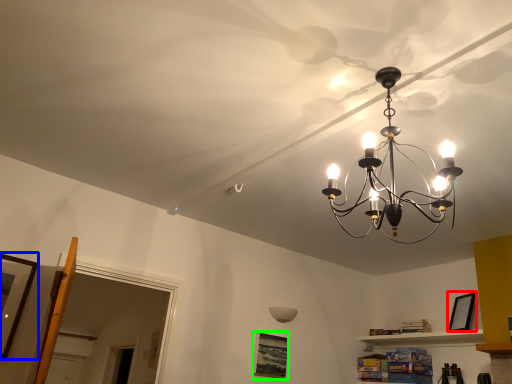
Question: Based on their relative distances, which object is farther from picture frame (highlighted by a red box)? Choose from picture frame (highlighted by a blue box) and picture frame (highlighted by a green box).

Choices:
 (A) picture frame
 (B) picture frame

Answer: (A)